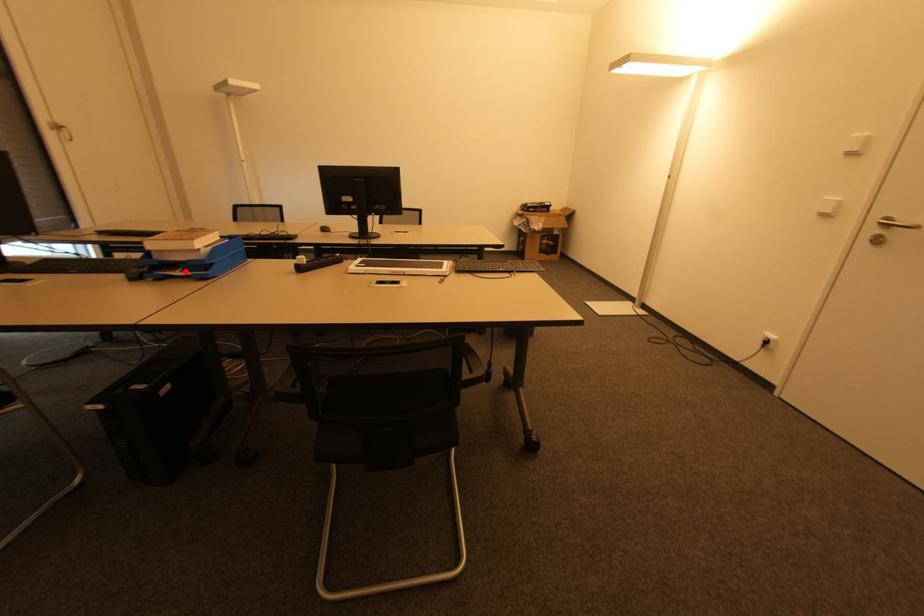
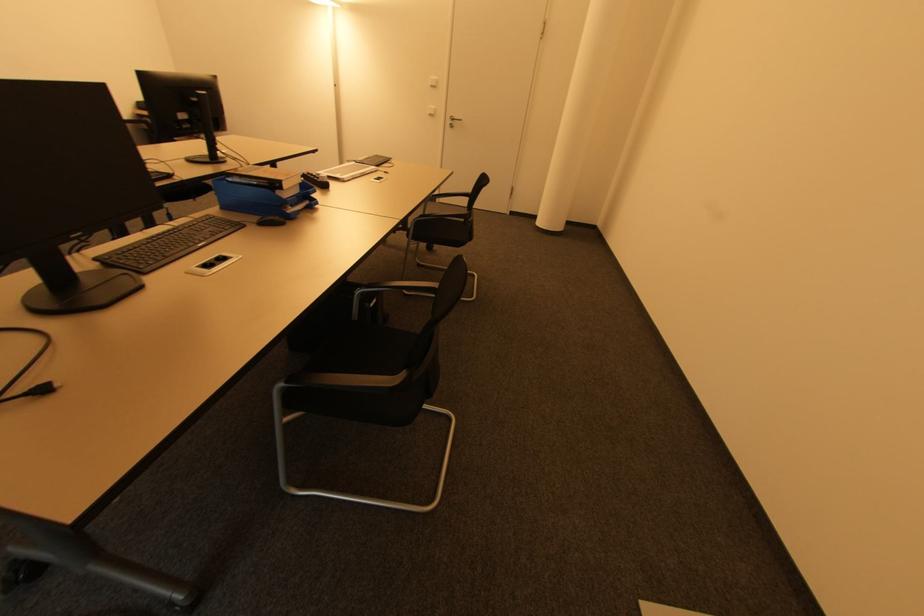
Where in the second image is the point corresponding to the highlighted location from the first image?

(294, 207)